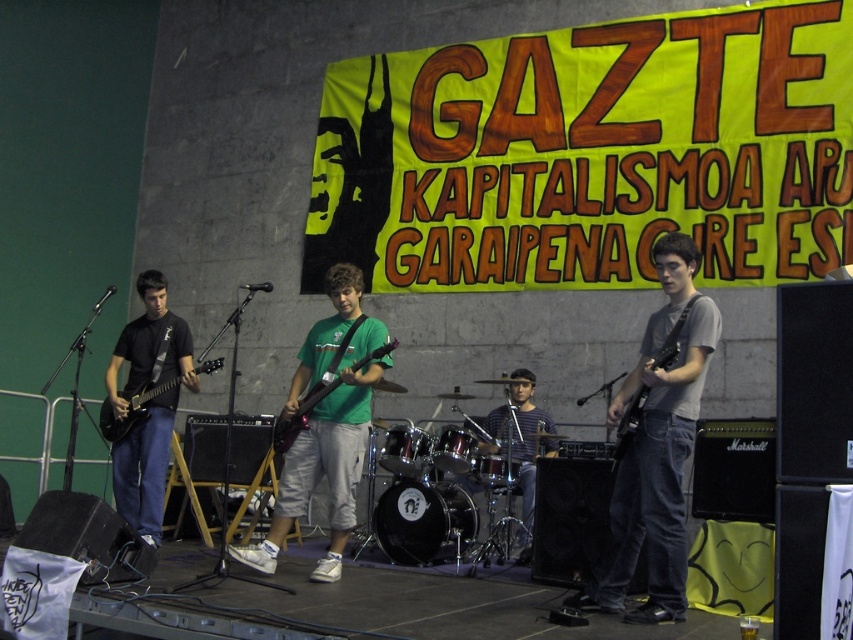
How far apart are matte gray shirt at center and striped fabric shirt at center?

matte gray shirt at center and striped fabric shirt at center are 6.04 feet apart from each other.

Who is more distant from viewer, (619, 556) or (500, 429)?

The point (500, 429) is behind.

Between point (682, 595) and point (531, 410), which one is positioned in front?

Point (682, 595) is more forward.

The width and height of the screenshot is (853, 640). What are the coordinates of `matte gray shirt at center` in the screenshot? It's located at (656, 448).

From the picture: Does striped fabric shirt at center have a smaller size compared to black matte electric guitar at left?

Actually, striped fabric shirt at center might be larger than black matte electric guitar at left.

Does striped fabric shirt at center appear over black matte electric guitar at left?

Actually, striped fabric shirt at center is below black matte electric guitar at left.

This screenshot has width=853, height=640. In order to click on striped fabric shirt at center in this screenshot , I will do `click(520, 442)`.

Does black matte electric guitar at left have a smaller size compared to matte black electric guitar at center?

Yes, black matte electric guitar at left is smaller than matte black electric guitar at center.

Identify the location of black matte electric guitar at left. (132, 408).

Is point (213, 364) behind point (318, 400)?

Yes, point (213, 364) is behind point (318, 400).

Identify the location of black matte electric guitar at left. The image size is (853, 640). (132, 408).